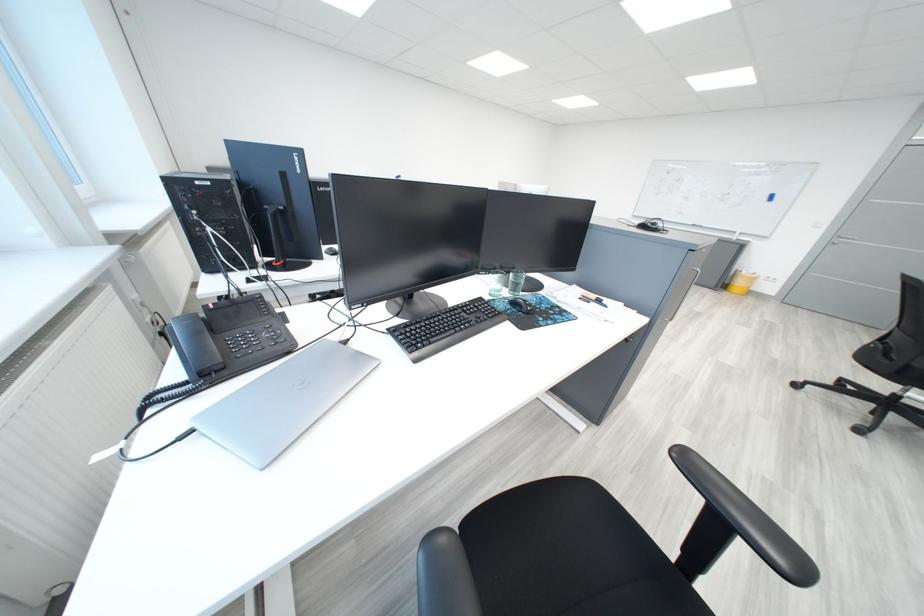
Where is `black chair sitting surface`? This screenshot has height=616, width=924. black chair sitting surface is located at coordinates (565, 554).